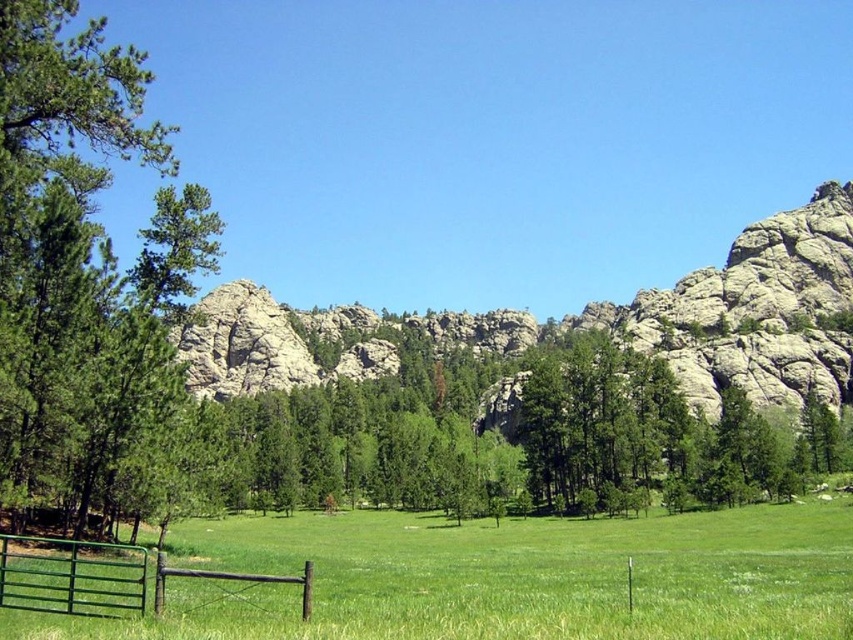
Question: Does rocky gray mountain at center have a greater width compared to green wooden gate at lower left?

Choices:
 (A) yes
 (B) no

Answer: (A)

Question: Can you confirm if green matte tree at left is positioned below rocky gray mountain at center?

Choices:
 (A) no
 (B) yes

Answer: (B)

Question: Is green matte tree at left further to the viewer compared to green wooden gate at lower left?

Choices:
 (A) yes
 (B) no

Answer: (A)

Question: Which point appears farthest from the camera in this image?

Choices:
 (A) (62, 568)
 (B) (144, 262)

Answer: (B)

Question: Estimate the real-world distances between objects in this image. Which object is closer to the green matte tree at left?

Choices:
 (A) green wooden gate at lower left
 (B) rocky gray mountain at center

Answer: (A)

Question: Which point is closer to the camera?

Choices:
 (A) (86, 248)
 (B) (756, 337)

Answer: (A)